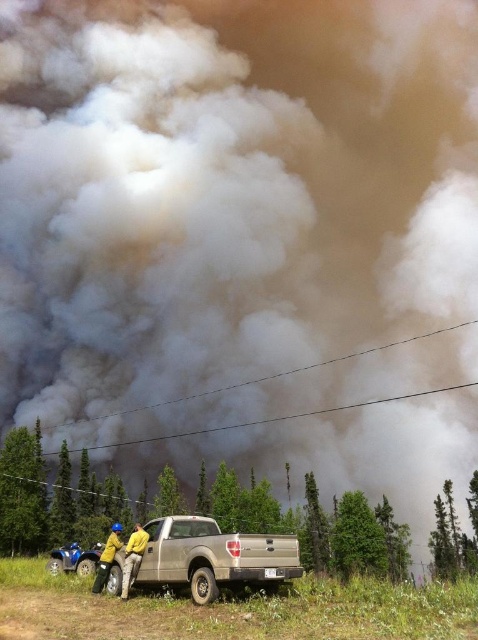
You are a firefighter assessing the wildfire scene. You notice two yellow items in the image. Which one is closer to you, the yellow fabric person at lower center or the yellow fabric jacket at lower left?

The yellow fabric person at lower center is closer to the viewer than the yellow fabric jacket at lower left.

You are a firefighter assessing the scene of the wildfire. You notice two people near the silver pickup truck. One is the yellow fabric person at lower center and the other is wearing the yellow fabric jacket at lower left. Which person appears smaller in size?

The yellow fabric person at lower center appears smaller in size because their width is less than that of the yellow fabric jacket at lower left.

You are a firefighter trying to reach the silver pickup truck parked on the grassy area. The wildfire is spreading rapidly. There is a point marked at coordinates (132, 557) which indicates the location of the yellow fabric person at lower center. Based on the scene, can you determine if the yellow fabric person at lower center is closer to the truck or the wildfire?

The point marked at (132, 557) indicates the yellow fabric person at lower center is closer to the silver pickup truck parked on the grassy area than to the wildfire, as the wildfire is shown in the upper portion of the frame while the truck is in the foreground near the person.